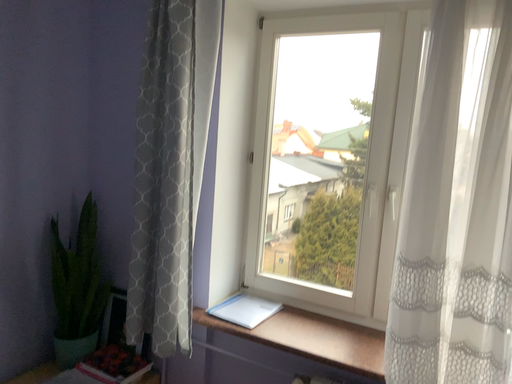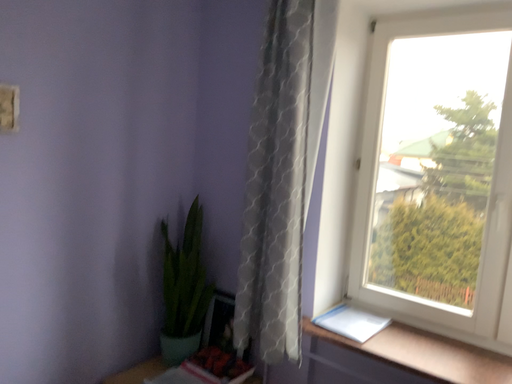
Question: Which way did the camera rotate in the video?

Choices:
 (A) rotated right
 (B) rotated left

Answer: (B)